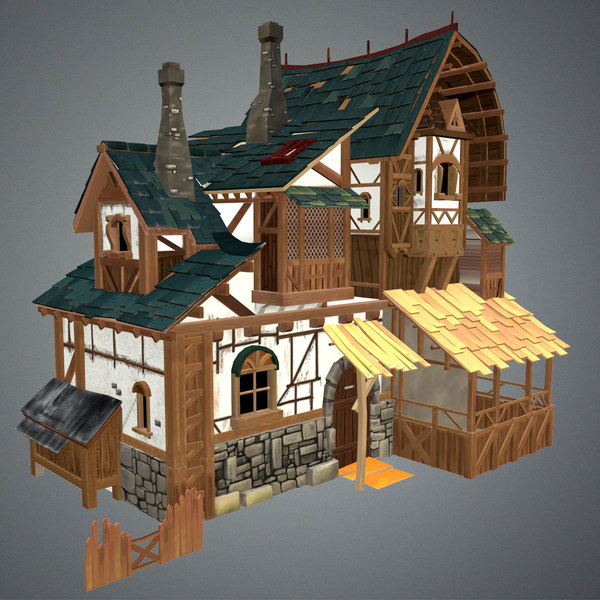
This screenshot has height=600, width=600. Find the location of `welcome mat`. welcome mat is located at coordinates (376, 473).